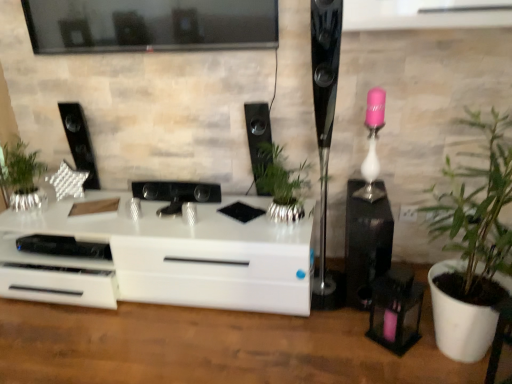
Question: Can you confirm if polished black speaker at right, the third speaker viewed from the left, is taller than silver metallic plant at left, which ranks as the 1th houseplant in left-to-right order?

Choices:
 (A) no
 (B) yes

Answer: (B)

Question: From the image's perspective, is polished black speaker at right, the third speaker viewed from the left, located beneath silver metallic plant at left, the third houseplant when ordered from right to left?

Choices:
 (A) yes
 (B) no

Answer: (B)

Question: From a real-world perspective, is polished black speaker at right, the third speaker viewed from the left, located higher than silver metallic plant at left, which ranks as the 1th houseplant in left-to-right order?

Choices:
 (A) no
 (B) yes

Answer: (B)

Question: Is polished black speaker at right, acting as the second speaker starting from the right, turned away from silver metallic plant at left, which ranks as the 1th houseplant in left-to-right order?

Choices:
 (A) yes
 (B) no

Answer: (B)

Question: Does polished black speaker at right, acting as the second speaker starting from the right, have a lesser width compared to silver metallic plant at left, the third houseplant when ordered from right to left?

Choices:
 (A) no
 (B) yes

Answer: (A)

Question: From their relative heights in the image, would you say green leafy plant at right, which is counted as the 3th houseplant, starting from the left, is taller or shorter than silver metallic plant at left, the third houseplant when ordered from right to left?

Choices:
 (A) tall
 (B) short

Answer: (A)

Question: Is point (501, 175) closer or farther from the camera than point (13, 188)?

Choices:
 (A) farther
 (B) closer

Answer: (B)

Question: Is green leafy plant at right, which is counted as the 3th houseplant, starting from the left, wider or thinner than silver metallic plant at left, which ranks as the 1th houseplant in left-to-right order?

Choices:
 (A) thin
 (B) wide

Answer: (B)

Question: Is green leafy plant at right, which is counted as the 3th houseplant, starting from the left, inside or outside of silver metallic plant at left, the third houseplant when ordered from right to left?

Choices:
 (A) inside
 (B) outside

Answer: (B)

Question: In the image, is silver metallic plant at left, the third houseplant when ordered from right to left, on the left side or the right side of black glossy speaker at right, the 1th speaker viewed from the right?

Choices:
 (A) right
 (B) left

Answer: (B)

Question: Considering the positions of silver metallic plant at left, which ranks as the 1th houseplant in left-to-right order, and black glossy speaker at right, the 1th speaker viewed from the right, in the image, is silver metallic plant at left, which ranks as the 1th houseplant in left-to-right order, wider or thinner than black glossy speaker at right, the 1th speaker viewed from the right,?

Choices:
 (A) wide
 (B) thin

Answer: (B)

Question: Considering the positions of silver metallic plant at left, which ranks as the 1th houseplant in left-to-right order, and black glossy speaker at right, which ranks as the 4th speaker in left-to-right order, in the image, is silver metallic plant at left, which ranks as the 1th houseplant in left-to-right order, taller or shorter than black glossy speaker at right, which ranks as the 4th speaker in left-to-right order,?

Choices:
 (A) tall
 (B) short

Answer: (B)

Question: In the image, is silver metallic plant at left, the third houseplant when ordered from right to left, positioned in front of or behind black glossy speaker at right, the 1th speaker viewed from the right?

Choices:
 (A) front
 (B) behind

Answer: (B)

Question: Is green leafy plant at right, the 1th houseplant when ordered from right to left, wider or thinner than black glossy speaker at center, which ranks as the 3th speaker in right-to-left order?

Choices:
 (A) thin
 (B) wide

Answer: (B)

Question: From a real-world perspective, is green leafy plant at right, which is counted as the 3th houseplant, starting from the left, above or below black glossy speaker at center, which ranks as the 3th speaker in right-to-left order?

Choices:
 (A) below
 (B) above

Answer: (A)